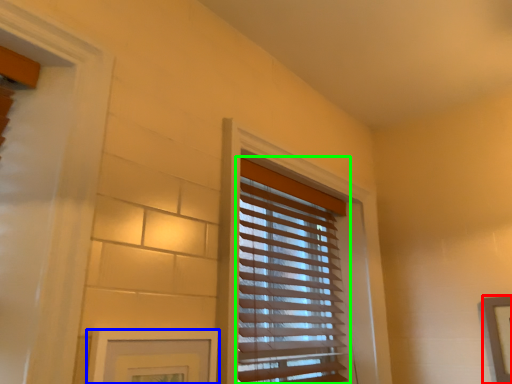
Question: Considering the real-world distances, which object is farthest from picture frame (highlighted by a red box)? picture frame (highlighted by a blue box) or window blind (highlighted by a green box)?

Choices:
 (A) picture frame
 (B) window blind

Answer: (A)